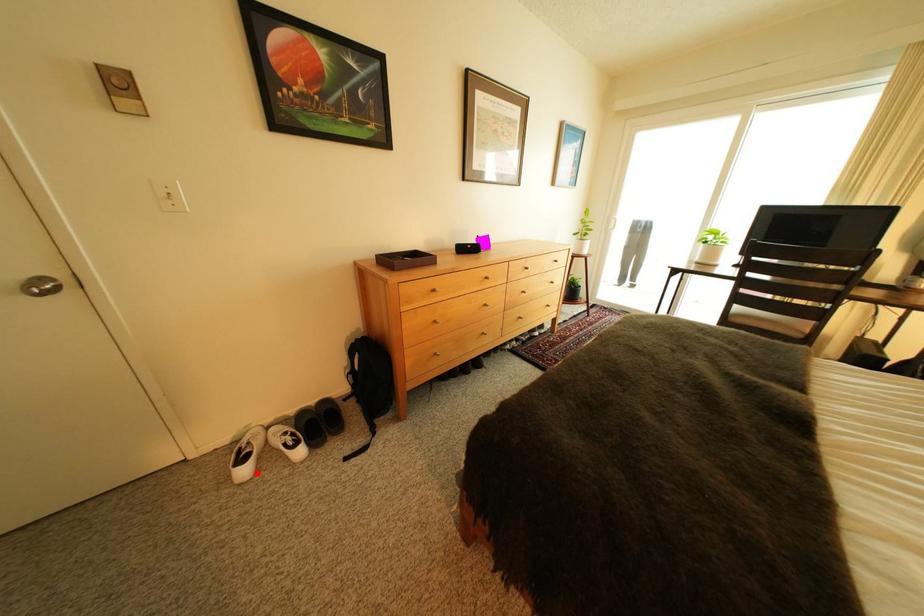
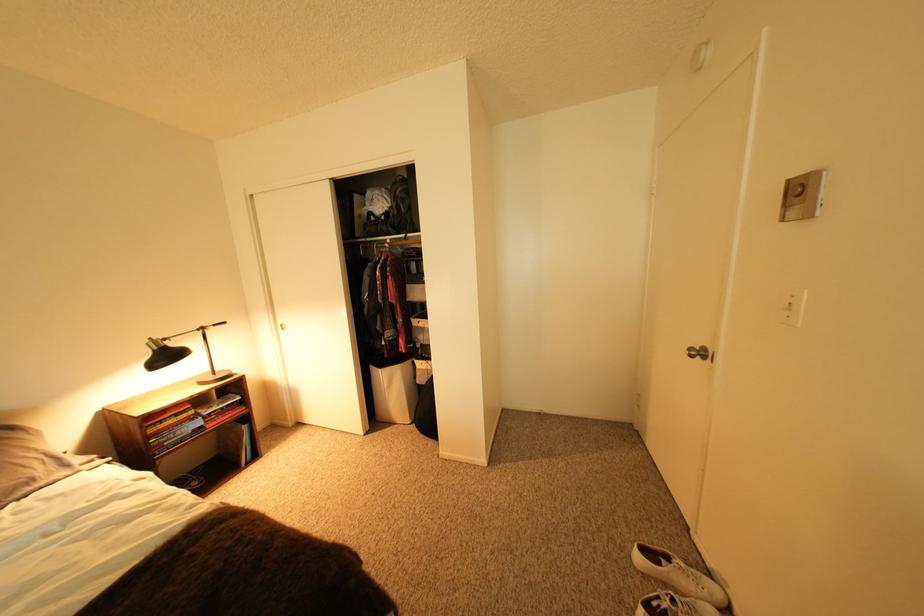
Question: I am providing you with two images of the same scene from different viewpoints. In image1, a red point is highlighted. Considering the same 3D point in image2, which of the following is correct?

Choices:
 (A) It is closer
 (B) It is farther

Answer: (B)